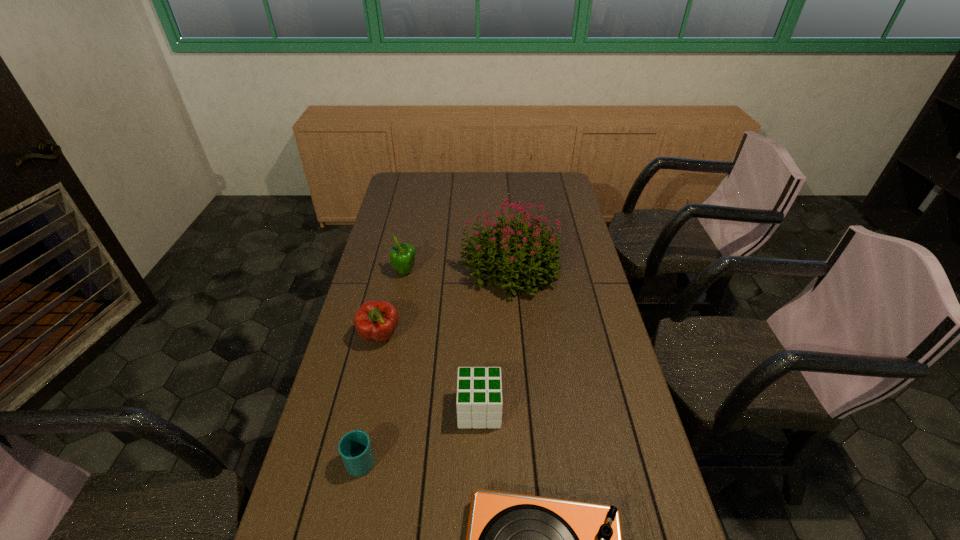
Find the location of a particular element. This screenshot has width=960, height=540. the tallest object is located at coordinates (539, 255).

Where is `the farther bell pepper`? The image size is (960, 540). the farther bell pepper is located at coordinates (402, 256).

Where is `the nearer bell pepper`? The height and width of the screenshot is (540, 960). the nearer bell pepper is located at coordinates (376, 321).

In order to click on the third farthest object in this screenshot , I will do `click(376, 321)`.

You are a GUI agent. You are given a task and a screenshot of the screen. Output one action in this format:
    pyautogui.click(x=<x>, y=<y>)
    Task: Click on the cube
    The image size is (960, 540).
    Given the screenshot: What is the action you would take?
    pyautogui.click(x=479, y=402)

Where is `cup`? cup is located at coordinates (355, 449).

You are a GUI agent. You are given a task and a screenshot of the screen. Output one action in this format:
    pyautogui.click(x=<x>, y=<y>)
    Task: Click on the vacant space located 0.100m on the back of the bouquet
    This screenshot has width=960, height=540.
    Given the screenshot: What is the action you would take?
    pyautogui.click(x=507, y=225)

The height and width of the screenshot is (540, 960). Find the location of `free point located 0.250m on the back of the farther bell pepper`. free point located 0.250m on the back of the farther bell pepper is located at coordinates (414, 227).

Locate an element on the screen. free space located 0.380m on the front of the fourth nearest object is located at coordinates (349, 472).

Where is `free space located 0.260m on the red face of the cube`? free space located 0.260m on the red face of the cube is located at coordinates (595, 410).